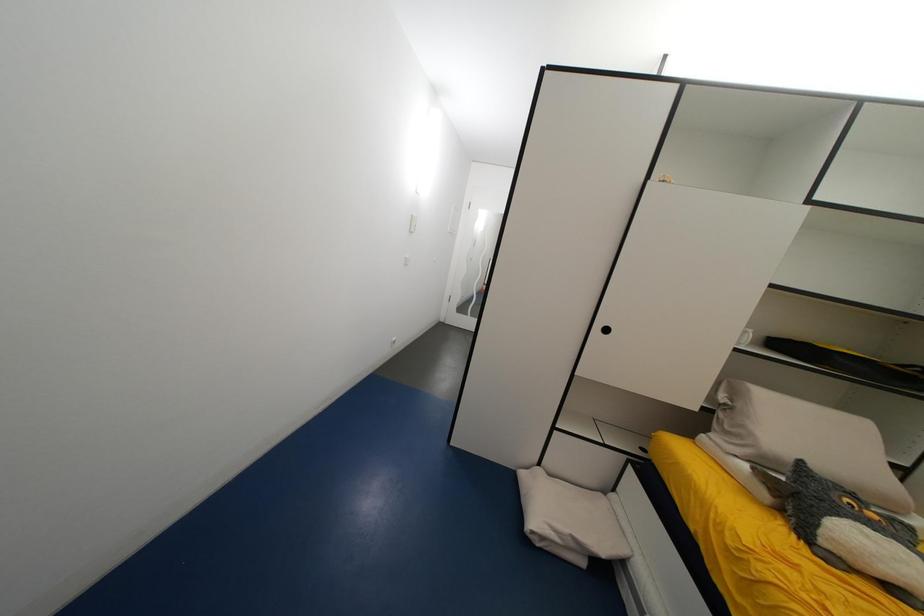
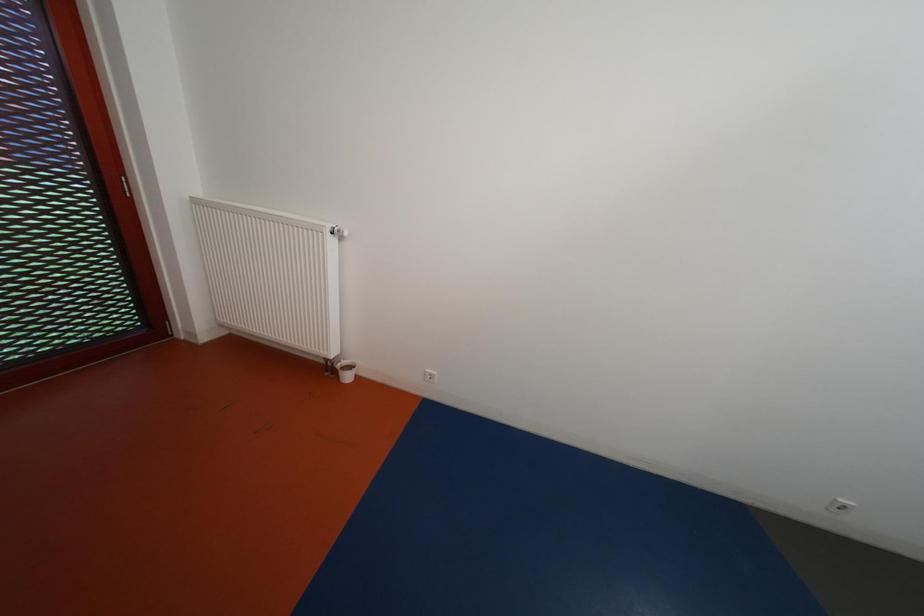
Question: The camera is either moving clockwise (left) or counter-clockwise (right) around the object. The first image is from the beginning of the video and the second image is from the end. Is the camera moving left or right when shooting the video?

Choices:
 (A) Left
 (B) Right

Answer: (B)